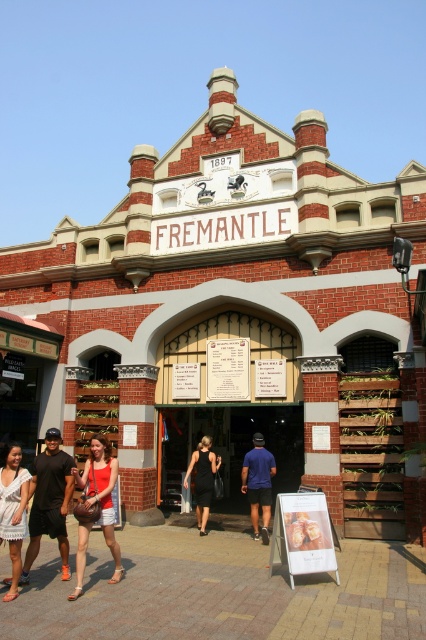
Question: Estimate the real-world distances between objects in this image. Which object is farther from the blue fabric shirt at center?

Choices:
 (A) white lace dress at lower left
 (B) black dress at center

Answer: (A)

Question: Does matte red tank top at center have a lesser width compared to black dress at center?

Choices:
 (A) yes
 (B) no

Answer: (A)

Question: From the image, what is the correct spatial relationship of matte red tank top at center in relation to blue fabric shirt at center?

Choices:
 (A) right
 (B) left

Answer: (B)

Question: Which point is closer to the camera?

Choices:
 (A) matte red tank top at center
 (B) black glass door at center

Answer: (A)

Question: Observing the image, what is the correct spatial positioning of black glass door at center in reference to matte black shorts at lower left?

Choices:
 (A) right
 (B) left

Answer: (A)

Question: Which of the following is the closest to the observer?

Choices:
 (A) matte red tank top at center
 (B) black glass door at center
 (C) blue fabric shirt at center
 (D) white lace dress at lower left

Answer: (D)